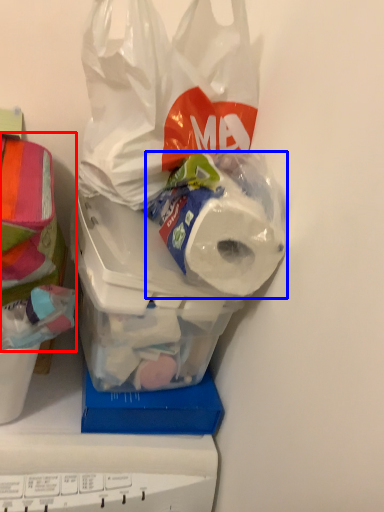
Question: Which object is closer to the camera taking this photo, wrapping paper (highlighted by a red box) or toilet paper (highlighted by a blue box)?

Choices:
 (A) wrapping paper
 (B) toilet paper

Answer: (A)